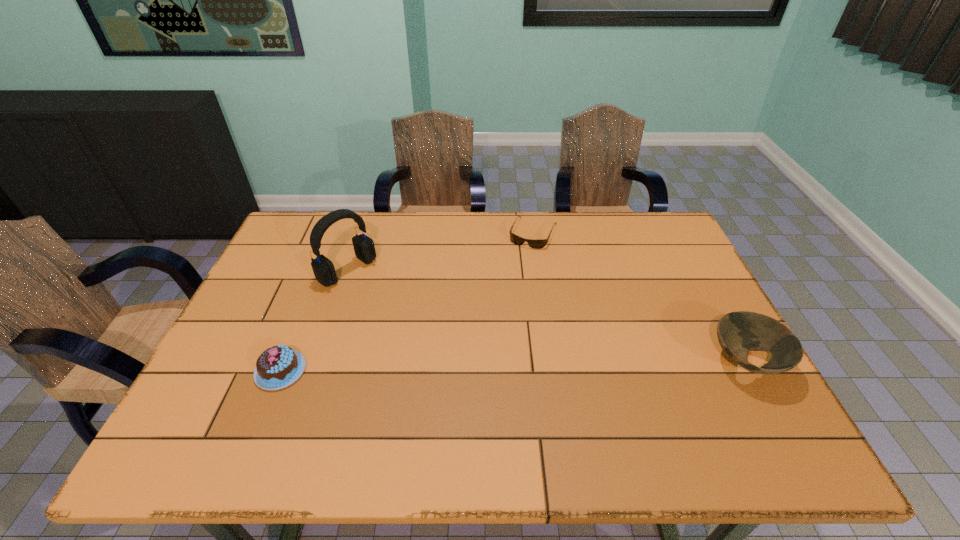
Locate an element on the screen. This screenshot has width=960, height=540. free space located on the front-facing side of the sunglasses is located at coordinates (509, 288).

You are a GUI agent. You are given a task and a screenshot of the screen. Output one action in this format:
    pyautogui.click(x=<x>, y=<y>)
    Task: Click on the vacant region located on the front-facing side of the sunglasses
    Image resolution: width=960 pixels, height=540 pixels.
    Given the screenshot: What is the action you would take?
    pyautogui.click(x=494, y=320)

I want to click on vacant space located 0.080m on the headband of the tallest object, so click(x=382, y=296).

Locate an element on the screen. The height and width of the screenshot is (540, 960). blank space located on the headband of the tallest object is located at coordinates (463, 357).

This screenshot has height=540, width=960. I want to click on vacant region located 0.140m on the headband of the tallest object, so click(x=396, y=307).

You are a GUI agent. You are given a task and a screenshot of the screen. Output one action in this format:
    pyautogui.click(x=<x>, y=<y>)
    Task: Click on the sunglasses that is at the far edge
    This screenshot has height=540, width=960.
    Given the screenshot: What is the action you would take?
    pyautogui.click(x=533, y=243)

The height and width of the screenshot is (540, 960). What are the coordinates of `headset located in the far edge section of the desktop` in the screenshot? It's located at (324, 271).

Where is `chocolate cake positioned at the near edge`? The width and height of the screenshot is (960, 540). chocolate cake positioned at the near edge is located at coordinates (277, 367).

Where is `bowl situated at the near edge`? bowl situated at the near edge is located at coordinates (739, 332).

I want to click on object at the left edge, so click(x=277, y=367).